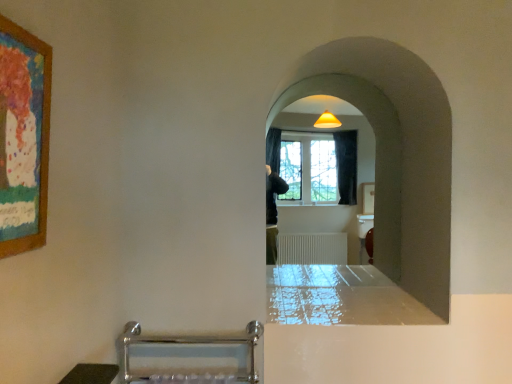
Question: Considering the relative sizes of glossy white counter top at center and wooden painted picture frame at upper left in the image provided, is glossy white counter top at center shorter than wooden painted picture frame at upper left?

Choices:
 (A) no
 (B) yes

Answer: (B)

Question: Does glossy white counter top at center have a greater width compared to wooden painted picture frame at upper left?

Choices:
 (A) yes
 (B) no

Answer: (A)

Question: From a real-world perspective, is glossy white counter top at center beneath wooden painted picture frame at upper left?

Choices:
 (A) yes
 (B) no

Answer: (A)

Question: Does glossy white counter top at center have a greater height compared to wooden painted picture frame at upper left?

Choices:
 (A) no
 (B) yes

Answer: (A)

Question: Is glossy white counter top at center closer to camera compared to wooden painted picture frame at upper left?

Choices:
 (A) no
 (B) yes

Answer: (A)

Question: Is glossy white counter top at center further to camera compared to wooden painted picture frame at upper left?

Choices:
 (A) no
 (B) yes

Answer: (B)

Question: From a real-world perspective, is wooden painted picture frame at upper left physically above glossy white counter top at center?

Choices:
 (A) yes
 (B) no

Answer: (A)

Question: Considering the relative sizes of wooden painted picture frame at upper left and glossy white counter top at center in the image provided, is wooden painted picture frame at upper left wider than glossy white counter top at center?

Choices:
 (A) no
 (B) yes

Answer: (A)

Question: Does wooden painted picture frame at upper left appear on the right side of glossy white counter top at center?

Choices:
 (A) no
 (B) yes

Answer: (A)

Question: Can you confirm if wooden painted picture frame at upper left is bigger than glossy white counter top at center?

Choices:
 (A) yes
 (B) no

Answer: (B)

Question: Is wooden painted picture frame at upper left surrounding glossy white counter top at center?

Choices:
 (A) no
 (B) yes

Answer: (A)

Question: Does wooden painted picture frame at upper left touch glossy white counter top at center?

Choices:
 (A) yes
 (B) no

Answer: (B)

Question: Is glossy white counter top at center smaller than white matte wall at center?

Choices:
 (A) no
 (B) yes

Answer: (B)